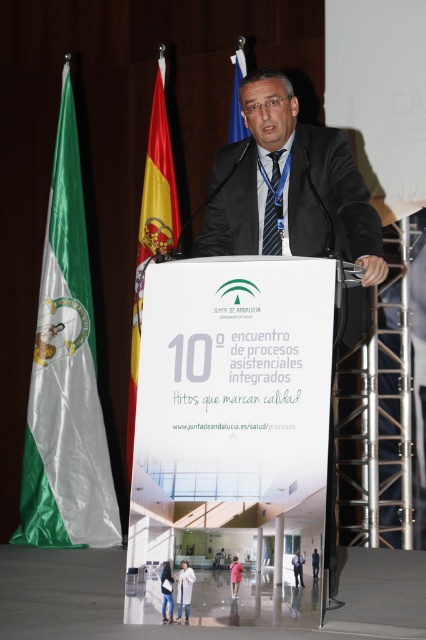
You are attending a formal event and notice two items in the front area. There is a red fabric flag at left and a blue striped tie at center. From your perspective as an attendee, which item is located more to the left?

The red fabric flag at left is more to the left than the blue striped tie at center.

You are an attendee at the event and want to take a photo of the podium. You notice the red fabric flag at left and the blue striped tie at center. Which object should you focus on first to ensure both are in the frame without moving the camera?

You should focus on the red fabric flag at left first because it is closer to you than the blue striped tie at center, ensuring both are in the frame without needing to adjust the camera position.

Consider the image. You are attending the event and want to take a photo that includes both the green silk flag at left and the blue fabric flag at upper center. Which flag should you position closer to the camera to ensure both are visible in the frame?

You should position the green silk flag at left closer to the camera since the blue fabric flag at upper center is behind it, ensuring both are visible in the frame.